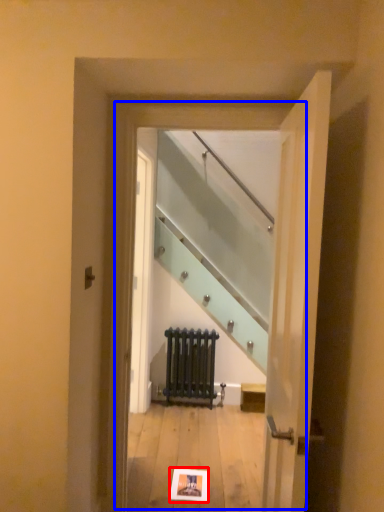
Question: Which of the following is the farthest to the observer, postcard (highlighted by a red box) or glass door (highlighted by a blue box)?

Choices:
 (A) postcard
 (B) glass door

Answer: (A)